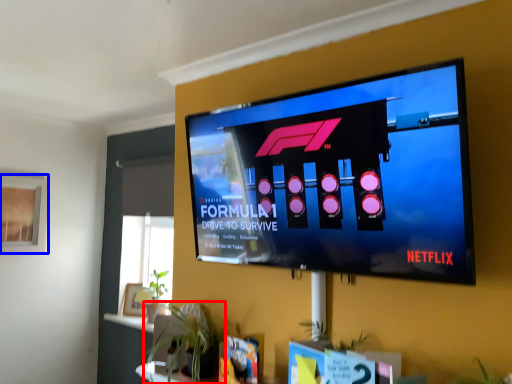
Question: Which of the following is the farthest to the observer, houseplant (highlighted by a red box) or window screen (highlighted by a blue box)?

Choices:
 (A) houseplant
 (B) window screen

Answer: (B)